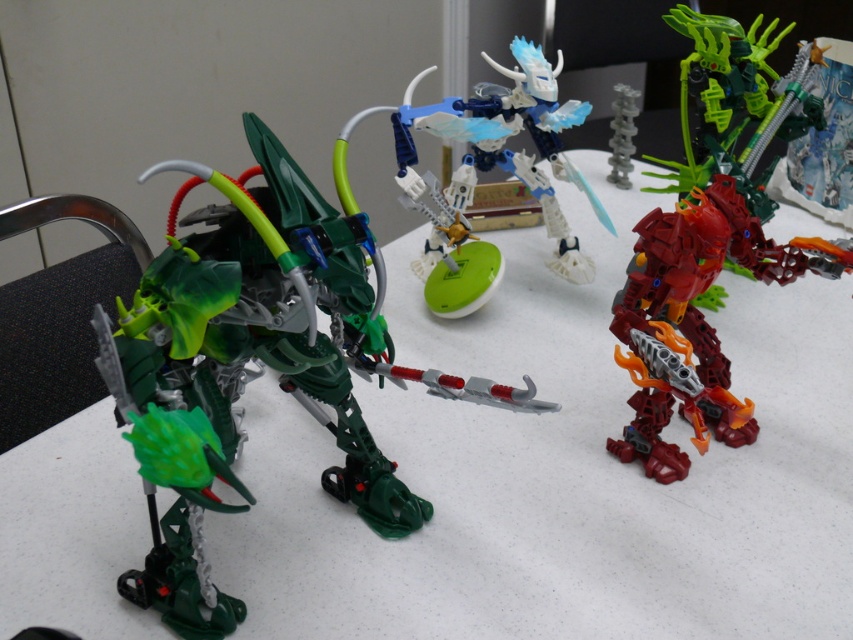
Question: Does green plastic robot at left come behind shiny red plastic robot at right?

Choices:
 (A) no
 (B) yes

Answer: (A)

Question: Which of the following is the farthest from the observer?

Choices:
 (A) (611, 144)
 (B) (184, 637)

Answer: (A)

Question: Does green plastic robot at left appear on the right side of shiny red plastic robot at right?

Choices:
 (A) no
 (B) yes

Answer: (A)

Question: Is shiny red plastic robot at right closer to the viewer compared to translucent gray spine at center?

Choices:
 (A) yes
 (B) no

Answer: (A)

Question: Considering the real-world distances, which object is farthest from the green plastic robot at left?

Choices:
 (A) translucent gray spine at center
 (B) shiny red plastic robot at right

Answer: (A)

Question: Which point appears farthest from the camera in this image?

Choices:
 (A) (627, 184)
 (B) (699, 280)
 (C) (264, 320)

Answer: (A)